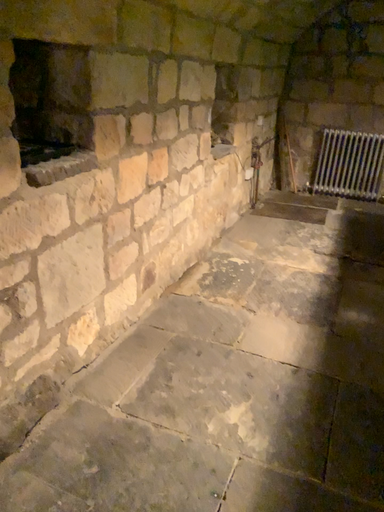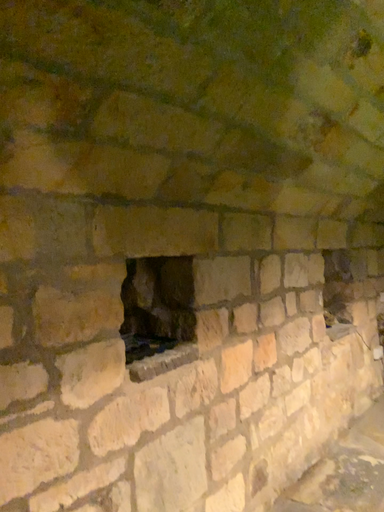
Question: How did the camera likely rotate when shooting the video?

Choices:
 (A) rotated upward
 (B) rotated downward

Answer: (A)